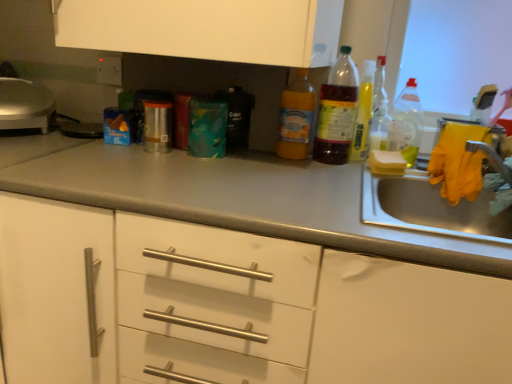
Find the location of a particular element. vacant space positioned to the left of translucent plastic bottle at center, the 5th bottle in the right-to-left sequence is located at coordinates (239, 155).